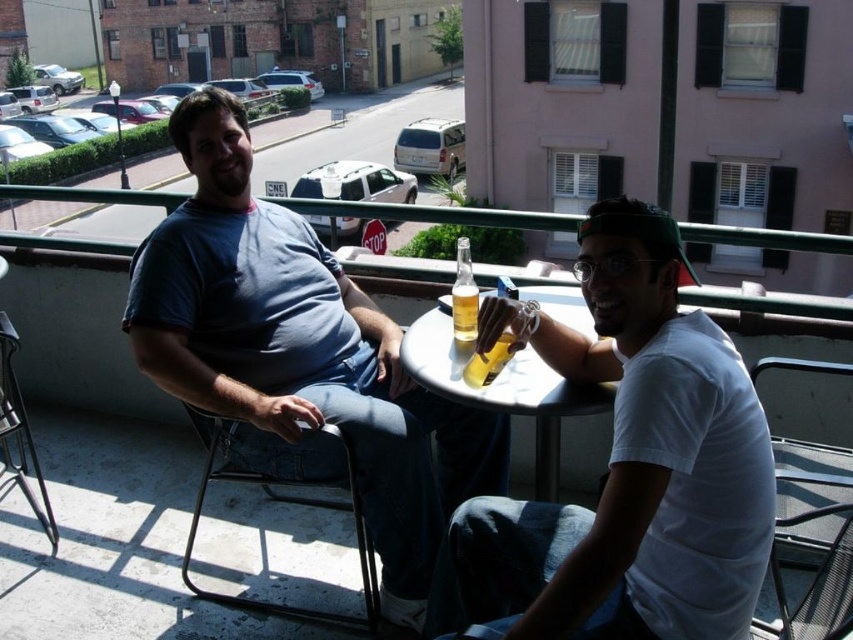
Question: Is metal mesh chair at lower right bigger than white glossy table at center?

Choices:
 (A) yes
 (B) no

Answer: (B)

Question: Which of the following is the farthest from the observer?

Choices:
 (A) (592, 273)
 (B) (846, 509)

Answer: (B)

Question: Which object is positioned closest to the white glossy table at center?

Choices:
 (A) white matte shirt at center
 (B) translucent glass bottle at center
 (C) metallic gray chair at left

Answer: (B)

Question: Estimate the real-world distances between objects in this image. Which object is closer to the metallic gray chair at left?

Choices:
 (A) white matte shirt at center
 (B) translucent glass beer at table center
 (C) metal mesh chair at lower right

Answer: (B)

Question: Does metallic gray chair at left have a lesser width compared to metallic gray chair at lower right?

Choices:
 (A) yes
 (B) no

Answer: (B)

Question: Does white glossy table at center have a greater width compared to metallic gray chair at left?

Choices:
 (A) no
 (B) yes

Answer: (A)